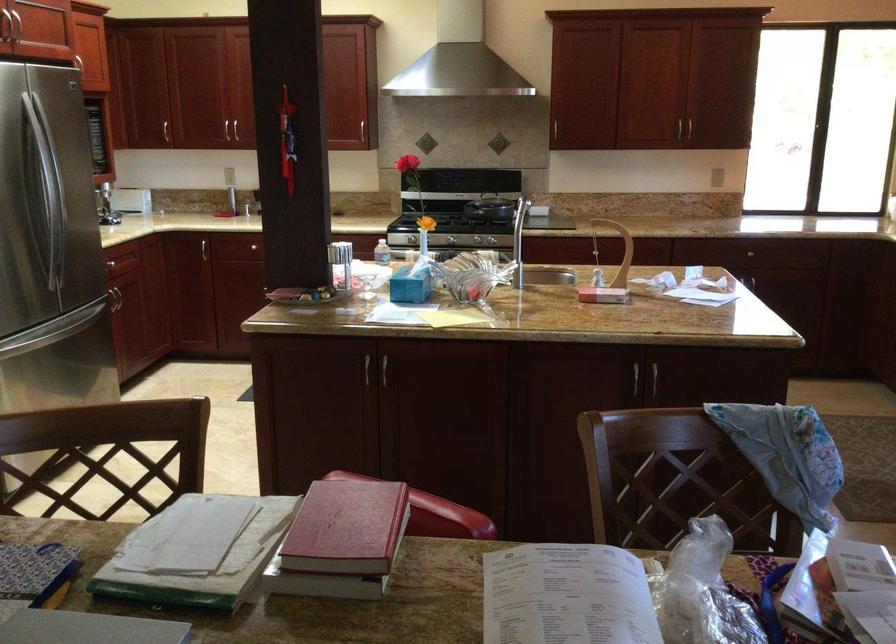
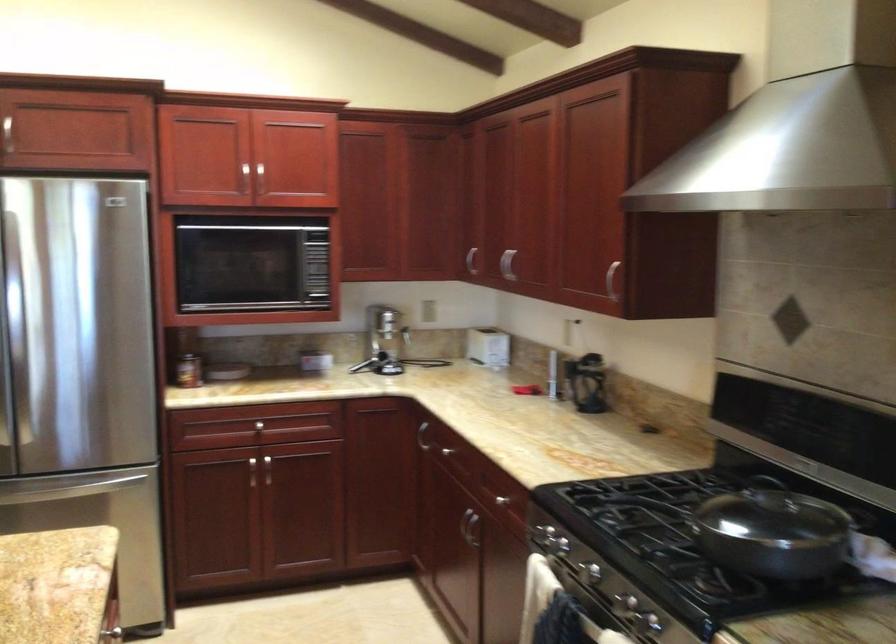
Question: I am providing you with two images of the same scene from different viewpoints. Which of the following objects are not visible in image2?

Choices:
 (A) black door hook
 (B) silver stovetop knob
 (C) faucet lever handle
 (D) silver cabinet handle

Answer: (D)